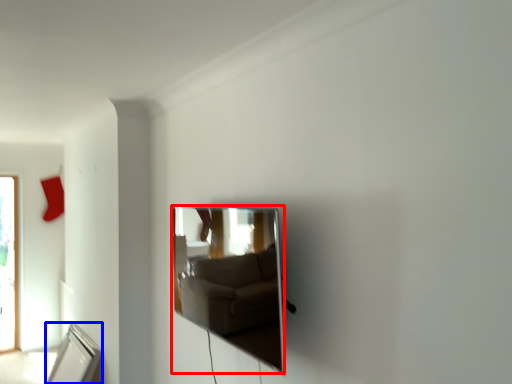
Question: Among these objects, which one is nearest to the camera, mirror (highlighted by a red box) or mirror (highlighted by a blue box)?

Choices:
 (A) mirror
 (B) mirror

Answer: (A)